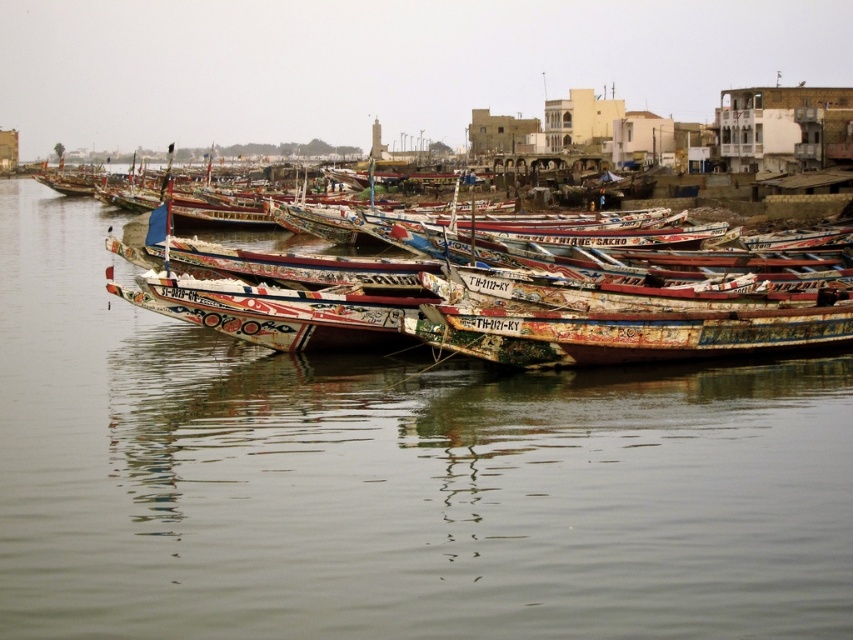
You are standing on the dock and want to take a photo of the painted wooden boats at center. If your camera has a zoom lens that can focus at a specific coordinate point, what coordinates should you set to capture the boats perfectly?

You should set the coordinates to point (392, 480) to capture the painted wooden boats at center perfectly as that is their exact position.

You are an observer standing on the dock and see the painted wooden boats at center and the painted wooden boat at center. Which one is wider?

The painted wooden boat at center is wider than the painted wooden boats at center.

You are standing at the shoreline in the waterfront scene and want to take a photo of both point (368, 593) and point (422, 330). Which point will appear larger in your photo?

Point (368, 593) will appear larger in the photo because it is closer to the camera than point (422, 330).